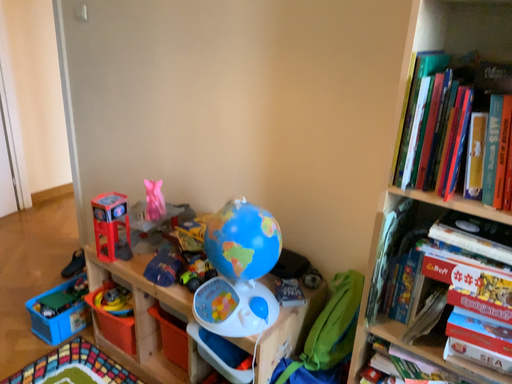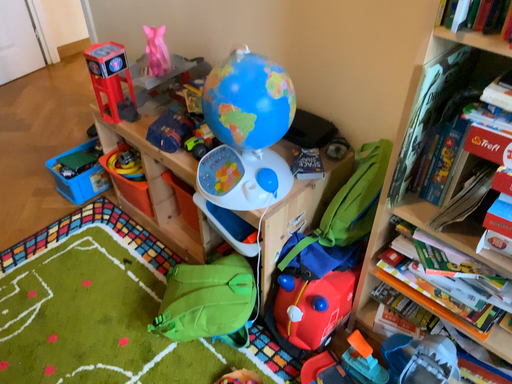
Question: How did the camera likely rotate when shooting the video?

Choices:
 (A) rotated right
 (B) rotated left

Answer: (B)